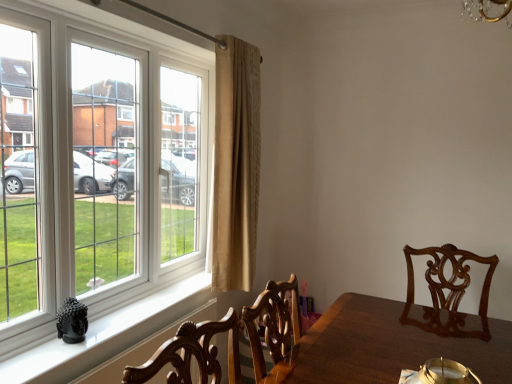
What is the approximate height of black glossy buddha statue at lower left?

It is 1.43 inches.

Where is `white plastic window at left`? Image resolution: width=512 pixels, height=384 pixels. white plastic window at left is located at coordinates (96, 163).

Is white plastic window at left far from black glossy buddha statue at lower left?

No, there isn't a large distance between white plastic window at left and black glossy buddha statue at lower left.

You are a GUI agent. You are given a task and a screenshot of the screen. Output one action in this format:
    pyautogui.click(x=<x>, y=<y>)
    Task: Click on the window above the black glossy buddha statue at lower left (from the image's perspective)
    
    Given the screenshot: What is the action you would take?
    pyautogui.click(x=96, y=163)

Could you tell me if white plastic window at left is facing black glossy buddha statue at lower left?

No, white plastic window at left does not turn towards black glossy buddha statue at lower left.

Can you confirm if white plastic window at left is shorter than black glossy buddha statue at lower left?

In fact, white plastic window at left may be taller than black glossy buddha statue at lower left.

From the picture: Can you confirm if beige textured curtain at center is bigger than black glossy buddha statue at lower left?

Indeed, beige textured curtain at center has a larger size compared to black glossy buddha statue at lower left.

Does beige textured curtain at center have a greater height compared to black glossy buddha statue at lower left?

Indeed, beige textured curtain at center has a greater height compared to black glossy buddha statue at lower left.

Is beige textured curtain at center inside or outside of black glossy buddha statue at lower left?

beige textured curtain at center is located beyond the bounds of black glossy buddha statue at lower left.

Which is behind, beige textured curtain at center or black glossy buddha statue at lower left?

beige textured curtain at center is more distant.

Looking at this image, how distant is black glossy buddha statue at lower left from beige textured curtain at center?

A distance of 69.03 centimeters exists between black glossy buddha statue at lower left and beige textured curtain at center.

Considering their positions, is black glossy buddha statue at lower left located in front of or behind beige textured curtain at center?

Clearly, black glossy buddha statue at lower left is in front of beige textured curtain at center.

Which is correct: black glossy buddha statue at lower left is inside beige textured curtain at center, or outside of it?

black glossy buddha statue at lower left exists outside the volume of beige textured curtain at center.

Who is bigger, black glossy buddha statue at lower left or beige textured curtain at center?

With larger size is beige textured curtain at center.

From a real-world perspective, is black glossy buddha statue at lower left physically below white plastic window at left?

Correct, in the physical world, black glossy buddha statue at lower left is lower than white plastic window at left.

Looking at this image, considering the sizes of objects black glossy buddha statue at lower left and white plastic window at left in the image provided, who is thinner, black glossy buddha statue at lower left or white plastic window at left?

With smaller width is black glossy buddha statue at lower left.

Between black glossy buddha statue at lower left and white plastic window at left, which one has more height?

white plastic window at left.

Is black glossy buddha statue at lower left positioned in front of white plastic window at left?

No, it is behind white plastic window at left.

Is beige textured curtain at center bigger or smaller than white plastic window at left?

In the image, beige textured curtain at center appears to be smaller than white plastic window at left.

Identify the location of curtain lying above the white plastic window at left (from the image's perspective). This screenshot has height=384, width=512. (236, 164).

From a real-world perspective, which is physically below, beige textured curtain at center or white plastic window at left?

From a 3D spatial view, white plastic window at left is below.

In terms of size, does white plastic window at left appear bigger or smaller than beige textured curtain at center?

white plastic window at left is bigger than beige textured curtain at center.

From the image's perspective, between white plastic window at left and beige textured curtain at center, who is located below?

white plastic window at left, from the image's perspective.

Considering the relative sizes of white plastic window at left and beige textured curtain at center in the image provided, is white plastic window at left shorter than beige textured curtain at center?

Indeed, white plastic window at left has a lesser height compared to beige textured curtain at center.

Where is `window lying on the left of black glossy buddha statue at lower left`? The image size is (512, 384). window lying on the left of black glossy buddha statue at lower left is located at coordinates (96, 163).

The image size is (512, 384). Identify the location of window sill beneath the beige textured curtain at center (from a real-world perspective). (99, 331).

From the image, which object appears to be nearer to black glossy buddha statue at lower left, white plastic window at left or beige textured curtain at center?

Among the two, white plastic window at left is located nearer to black glossy buddha statue at lower left.

Which object lies further to the anchor point beige textured curtain at center, black glossy buddha statue at lower left or white plastic window at left?

The object further to beige textured curtain at center is black glossy buddha statue at lower left.

Considering their positions, is beige textured curtain at center positioned closer to white plastic window at left than black glossy buddha statue at lower left?

Among the two, beige textured curtain at center is located nearer to white plastic window at left.

Considering their positions, is white plastic window at left positioned closer to beige textured curtain at center than black glossy buddha statue at lower left?

white plastic window at left is positioned closer to the anchor beige textured curtain at center.

Looking at the image, which one is located closer to black glossy buddha statue at lower left, beige textured curtain at center or white plastic window at left?

The object closer to black glossy buddha statue at lower left is white plastic window at left.

Considering their positions, is black glossy buddha statue at lower left positioned closer to white plastic window at left than beige textured curtain at center?

beige textured curtain at center.

What are the coordinates of `window sill between white plastic window at left and beige textured curtain at center from front to back` in the screenshot? It's located at (99, 331).